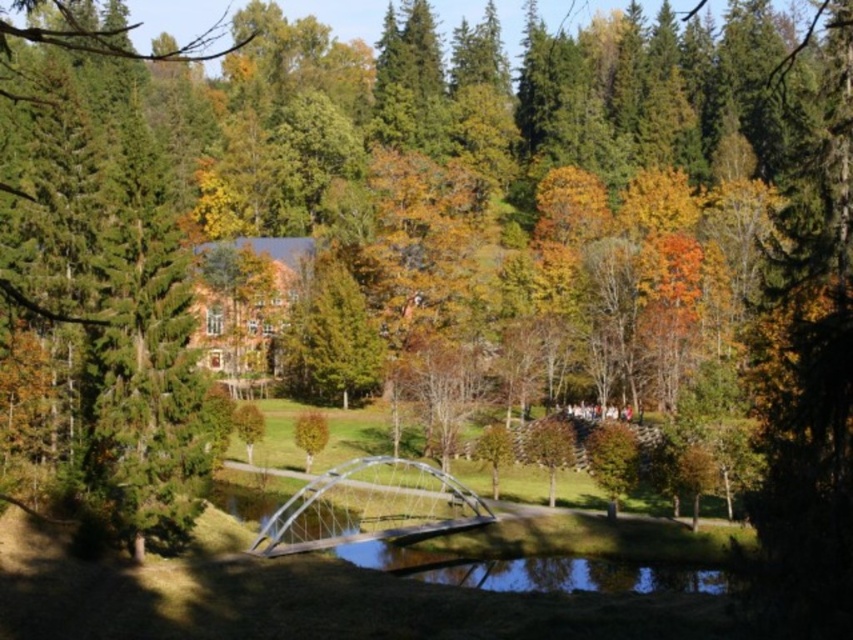
Is clear glass bridge at center above yellow-green leafy tree at center?

Incorrect, clear glass bridge at center is not positioned above yellow-green leafy tree at center.

The image size is (853, 640). Find the location of `clear glass bridge at center`. clear glass bridge at center is located at coordinates (370, 506).

Is point (155, 308) more distant than point (340, 529)?

No, (155, 308) is closer to viewer.

How much distance is there between green coniferous tree at left and clear glass bridge at center?

84.64 feet

Identify the location of green coniferous tree at left. This screenshot has width=853, height=640. (109, 273).

Between green coniferous tree at left and yellow-green leafy tree at center, which one has less height?

With less height is yellow-green leafy tree at center.

Can you confirm if green coniferous tree at left is positioned to the left of yellow-green leafy tree at center?

Indeed, green coniferous tree at left is positioned on the left side of yellow-green leafy tree at center.

Who is more forward, (184, 353) or (328, 432)?

Point (184, 353)

The image size is (853, 640). Identify the location of green coniferous tree at left. (109, 273).